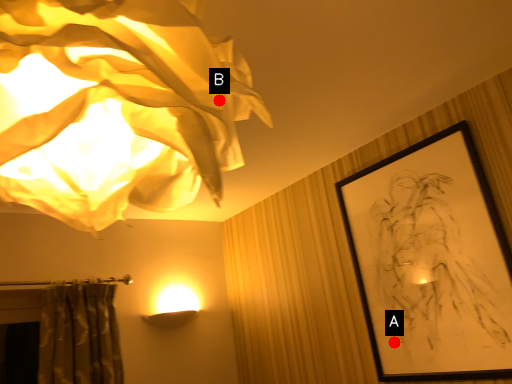
Question: Two points are circled on the image, labeled by A and B beside each circle. Which point is closer to the camera taking this photo?

Choices:
 (A) A is closer
 (B) B is closer

Answer: (B)